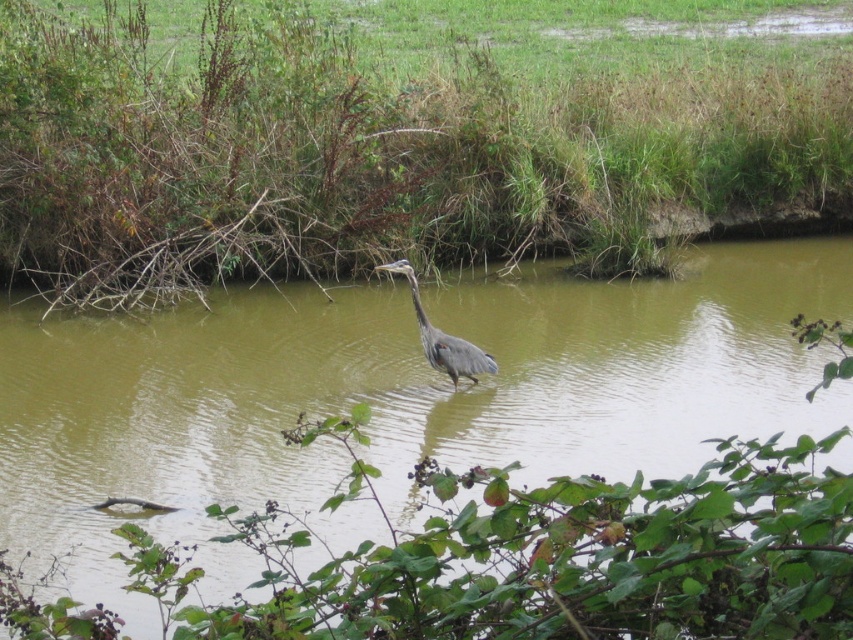
Is green grass at center below gray matte heron at center?

No, green grass at center is not below gray matte heron at center.

Is green grass at center above gray matte heron at center?

Yes, green grass at center is above gray matte heron at center.

The image size is (853, 640). What do you see at coordinates (363, 156) in the screenshot?
I see `green grass at center` at bounding box center [363, 156].

At what (x,y) coordinates should I click in order to perform the action: click on green grass at center. Please return your answer as a coordinate pair (x, y). Looking at the image, I should click on (363, 156).

Does green grass at center have a greater width compared to brown murky water at center?

Yes.

Which is behind, point (308, 42) or point (518, 372)?

The point (308, 42) is behind.

Find the location of a particular element. This screenshot has width=853, height=640. green grass at center is located at coordinates (363, 156).

This screenshot has height=640, width=853. Describe the element at coordinates (403, 387) in the screenshot. I see `brown murky water at center` at that location.

Does point (729, 276) come in front of point (457, 355)?

No.

The image size is (853, 640). I want to click on brown murky water at center, so click(x=403, y=387).